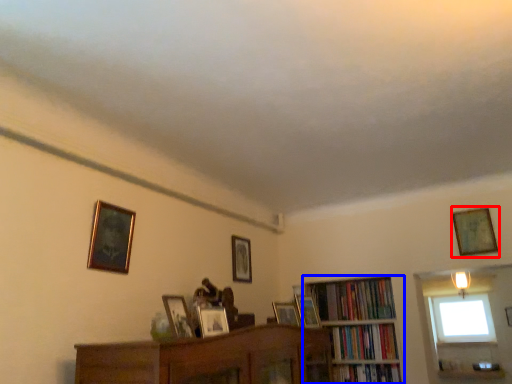
Question: Which of the following is the closest to the observer, picture frame (highlighted by a red box) or bookcase (highlighted by a blue box)?

Choices:
 (A) picture frame
 (B) bookcase

Answer: (A)